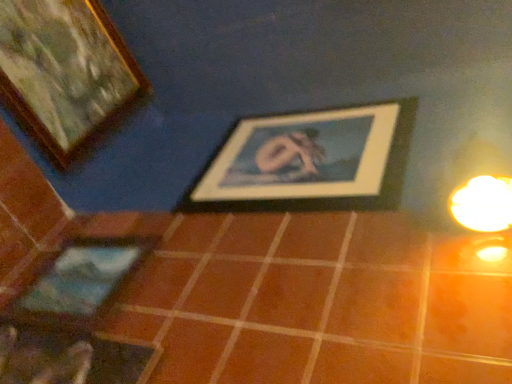
Describe the element at coordinates (311, 299) in the screenshot. I see `brown matte tile at center` at that location.

The width and height of the screenshot is (512, 384). I want to click on wooden framed picture at center, which appears as the 1th picture frame when viewed from the right, so click(309, 161).

Find the location of a particular element. This screenshot has height=384, width=512. wooden picture frame at upper left, which ranks as the first picture frame in left-to-right order is located at coordinates (66, 75).

How much distance is there between brown matte tile at center and wooden picture frame at upper left, acting as the third picture frame starting from the right?

brown matte tile at center is 29.47 inches away from wooden picture frame at upper left, acting as the third picture frame starting from the right.

From a real-world perspective, which is physically above, brown matte tile at center or wooden picture frame at upper left, which ranks as the first picture frame in left-to-right order?

From a 3D spatial view, wooden picture frame at upper left, which ranks as the first picture frame in left-to-right order, is above.

Who is bigger, brown matte tile at center or wooden picture frame at upper left, the 3th picture frame in the bottom-to-top sequence?

Bigger between the two is brown matte tile at center.

Identify the location of tile below the wooden picture frame at upper left, which is the first picture frame from top to bottom (from a real-world perspective). Image resolution: width=512 pixels, height=384 pixels. [311, 299].

Does matte blue picture frame at lower left, the 2th picture frame positioned from the right, have a lesser height compared to wooden picture frame at upper left, the 3th picture frame in the bottom-to-top sequence?

Yes.

Is matte blue picture frame at lower left, which appears as the 1th picture frame when ordered from the bottom, facing towards wooden picture frame at upper left, which ranks as the first picture frame in left-to-right order?

No, matte blue picture frame at lower left, which appears as the 1th picture frame when ordered from the bottom, is not oriented towards wooden picture frame at upper left, which ranks as the first picture frame in left-to-right order.

From the image's perspective, between matte blue picture frame at lower left, positioned as the 3th picture frame in top-to-bottom order, and wooden picture frame at upper left, acting as the third picture frame starting from the right, who is located below?

matte blue picture frame at lower left, positioned as the 3th picture frame in top-to-bottom order, is shown below in the image.

Is matte blue picture frame at lower left, positioned as the 2th picture frame in left-to-right order, situated inside wooden picture frame at upper left, which ranks as the first picture frame in left-to-right order, or outside?

matte blue picture frame at lower left, positioned as the 2th picture frame in left-to-right order, cannot be found inside wooden picture frame at upper left, which ranks as the first picture frame in left-to-right order.

Based on their positions, is brown matte tile at center located to the left or right of wooden framed picture at center, which is the third picture frame from left to right?

brown matte tile at center is positioned on wooden framed picture at center, which is the third picture frame from left to right,'s left side.

Considering the sizes of brown matte tile at center and wooden framed picture at center, the 2th picture frame positioned from the top, in the image, is brown matte tile at center taller or shorter than wooden framed picture at center, the 2th picture frame positioned from the top,?

brown matte tile at center is shorter than wooden framed picture at center, the 2th picture frame positioned from the top.

Does wooden picture frame at upper left, acting as the third picture frame starting from the right, appear on the left side of brown matte tile at center?

Correct, you'll find wooden picture frame at upper left, acting as the third picture frame starting from the right, to the left of brown matte tile at center.

From the image's perspective, is wooden picture frame at upper left, the 3th picture frame in the bottom-to-top sequence, located above or below brown matte tile at center?

Clearly, from the image's perspective, wooden picture frame at upper left, the 3th picture frame in the bottom-to-top sequence, is above brown matte tile at center.

How much distance is there between wooden picture frame at upper left, which is the first picture frame from top to bottom, and brown matte tile at center?

wooden picture frame at upper left, which is the first picture frame from top to bottom, and brown matte tile at center are 29.47 inches apart from each other.

Looking at this image, is wooden picture frame at upper left, acting as the third picture frame starting from the right, situated inside brown matte tile at center or outside?

wooden picture frame at upper left, acting as the third picture frame starting from the right, is not enclosed by brown matte tile at center.

Where is `picture frame on the right side of matte blue picture frame at lower left, positioned as the 2th picture frame in left-to-right order`? This screenshot has height=384, width=512. picture frame on the right side of matte blue picture frame at lower left, positioned as the 2th picture frame in left-to-right order is located at coordinates (309, 161).

From a real-world perspective, which object rests below the other?

matte blue picture frame at lower left, which appears as the 1th picture frame when ordered from the bottom.

Does point (307, 148) come closer to viewer compared to point (139, 246)?

That is False.

Which object is further away from the camera, wooden framed picture at center, which appears as the 1th picture frame when viewed from the right, or matte blue picture frame at lower left, positioned as the 3th picture frame in top-to-bottom order?

Positioned behind is wooden framed picture at center, which appears as the 1th picture frame when viewed from the right.

Would you say matte blue picture frame at lower left, the 2th picture frame positioned from the right, is part of wooden picture frame at upper left, acting as the third picture frame starting from the right,'s contents?

No, matte blue picture frame at lower left, the 2th picture frame positioned from the right, is not surrounded by wooden picture frame at upper left, acting as the third picture frame starting from the right.

Which is in front, wooden picture frame at upper left, the 3th picture frame in the bottom-to-top sequence, or matte blue picture frame at lower left, which appears as the 1th picture frame when ordered from the bottom?

matte blue picture frame at lower left, which appears as the 1th picture frame when ordered from the bottom, is in front.

Is wooden picture frame at upper left, which is the first picture frame from top to bottom, oriented towards matte blue picture frame at lower left, positioned as the 2th picture frame in left-to-right order?

No, wooden picture frame at upper left, which is the first picture frame from top to bottom, does not turn towards matte blue picture frame at lower left, positioned as the 2th picture frame in left-to-right order.

From the image's perspective, is wooden picture frame at upper left, the 3th picture frame in the bottom-to-top sequence, located above matte blue picture frame at lower left, positioned as the 2th picture frame in left-to-right order?

Correct, wooden picture frame at upper left, the 3th picture frame in the bottom-to-top sequence, appears higher than matte blue picture frame at lower left, positioned as the 2th picture frame in left-to-right order, in the image.

Which object is further away from the camera taking this photo, matte blue picture frame at lower left, which appears as the 1th picture frame when ordered from the bottom, or wooden framed picture at center, which appears as the 1th picture frame when viewed from the right?

Positioned behind is wooden framed picture at center, which appears as the 1th picture frame when viewed from the right.

Considering the sizes of objects matte blue picture frame at lower left, positioned as the 2th picture frame in left-to-right order, and wooden framed picture at center, the 2th picture frame positioned from the bottom, in the image provided, who is wider, matte blue picture frame at lower left, positioned as the 2th picture frame in left-to-right order, or wooden framed picture at center, the 2th picture frame positioned from the bottom,?

wooden framed picture at center, the 2th picture frame positioned from the bottom, is wider.

This screenshot has width=512, height=384. Identify the location of picture frame that is the 1st object located above the matte blue picture frame at lower left, positioned as the 3th picture frame in top-to-bottom order (from the image's perspective). (309, 161).

From a real-world perspective, is matte blue picture frame at lower left, positioned as the 3th picture frame in top-to-bottom order, positioned over wooden framed picture at center, the 2th picture frame positioned from the top, based on gravity?

Actually, matte blue picture frame at lower left, positioned as the 3th picture frame in top-to-bottom order, is physically below wooden framed picture at center, the 2th picture frame positioned from the top, in the real world.

You are a GUI agent. You are given a task and a screenshot of the screen. Output one action in this format:
    pyautogui.click(x=<x>, y=<y>)
    Task: Click on the tile below the wooden picture frame at upper left, acting as the third picture frame starting from the right (from a real-world perspective)
    
    Given the screenshot: What is the action you would take?
    pyautogui.click(x=311, y=299)

There is a matte blue picture frame at lower left, the 2th picture frame positioned from the right. Identify the location of the 2nd picture frame above it (from a real-world perspective). The height and width of the screenshot is (384, 512). (66, 75).

When comparing their distances from brown matte tile at center, does wooden framed picture at center, which appears as the 1th picture frame when viewed from the right, or wooden picture frame at upper left, acting as the third picture frame starting from the right, seem closer?

wooden framed picture at center, which appears as the 1th picture frame when viewed from the right, is closer to brown matte tile at center.

When comparing their distances from brown matte tile at center, does wooden picture frame at upper left, acting as the third picture frame starting from the right, or wooden framed picture at center, which appears as the 1th picture frame when viewed from the right, seem further?

wooden picture frame at upper left, acting as the third picture frame starting from the right, is positioned further to the anchor brown matte tile at center.

Which object lies nearer to the anchor point wooden framed picture at center, the 2th picture frame positioned from the bottom, wooden picture frame at upper left, which ranks as the first picture frame in left-to-right order, or brown matte tile at center?

The object closer to wooden framed picture at center, the 2th picture frame positioned from the bottom, is brown matte tile at center.

Looking at the image, which one is located further to matte blue picture frame at lower left, the 2th picture frame positioned from the right, brown matte tile at center or wooden picture frame at upper left, which ranks as the first picture frame in left-to-right order?

Based on the image, wooden picture frame at upper left, which ranks as the first picture frame in left-to-right order, appears to be further to matte blue picture frame at lower left, the 2th picture frame positioned from the right.

Considering their positions, is matte blue picture frame at lower left, which appears as the 1th picture frame when ordered from the bottom, positioned further to wooden framed picture at center, which appears as the 1th picture frame when viewed from the right, than brown matte tile at center?

matte blue picture frame at lower left, which appears as the 1th picture frame when ordered from the bottom, lies further to wooden framed picture at center, which appears as the 1th picture frame when viewed from the right, than the other object.

Which object lies nearer to the anchor point wooden picture frame at upper left, which is the first picture frame from top to bottom, matte blue picture frame at lower left, the 2th picture frame positioned from the right, or brown matte tile at center?

Among the two, matte blue picture frame at lower left, the 2th picture frame positioned from the right, is located nearer to wooden picture frame at upper left, which is the first picture frame from top to bottom.

From the image, which object appears to be nearer to wooden framed picture at center, the 2th picture frame positioned from the top, brown matte tile at center or matte blue picture frame at lower left, which appears as the 1th picture frame when ordered from the bottom?

The object closer to wooden framed picture at center, the 2th picture frame positioned from the top, is brown matte tile at center.

Looking at the image, which one is located further to wooden picture frame at upper left, acting as the third picture frame starting from the right, wooden framed picture at center, which appears as the 1th picture frame when viewed from the right, or brown matte tile at center?

brown matte tile at center.

Where is `tile between wooden picture frame at upper left, which ranks as the first picture frame in left-to-right order, and matte blue picture frame at lower left, which appears as the 1th picture frame when ordered from the bottom, in the up-down direction`? tile between wooden picture frame at upper left, which ranks as the first picture frame in left-to-right order, and matte blue picture frame at lower left, which appears as the 1th picture frame when ordered from the bottom, in the up-down direction is located at coordinates (311, 299).

The width and height of the screenshot is (512, 384). I want to click on tile between wooden picture frame at upper left, acting as the third picture frame starting from the right, and wooden framed picture at center, which is the third picture frame from left to right, in the horizontal direction, so click(x=311, y=299).

Locate an element on the screen. Image resolution: width=512 pixels, height=384 pixels. picture frame situated between wooden picture frame at upper left, which ranks as the first picture frame in left-to-right order, and wooden framed picture at center, the 2th picture frame positioned from the bottom, from left to right is located at coordinates (80, 282).

Locate an element on the screen. This screenshot has height=384, width=512. tile between matte blue picture frame at lower left, positioned as the 3th picture frame in top-to-bottom order, and wooden framed picture at center, which is the third picture frame from left to right is located at coordinates (311, 299).